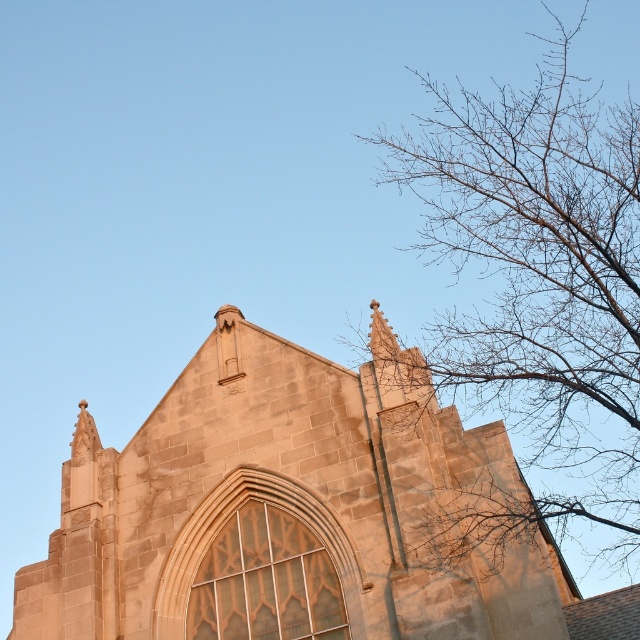
Can you confirm if stone church at center is positioned below bare branches at upper right?

Indeed, stone church at center is positioned under bare branches at upper right.

Does point (44, 628) come farther from viewer compared to point (492, 337)?

No, it is not.

The height and width of the screenshot is (640, 640). What are the coordinates of `stone church at center` in the screenshot? It's located at (282, 509).